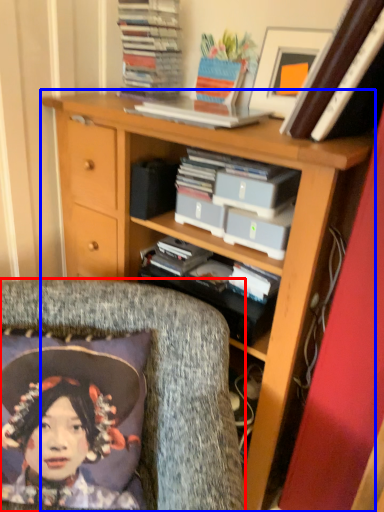
Question: Which point is further to the camera, chair (highlighted by a red box) or bookcase (highlighted by a blue box)?

Choices:
 (A) chair
 (B) bookcase

Answer: (B)